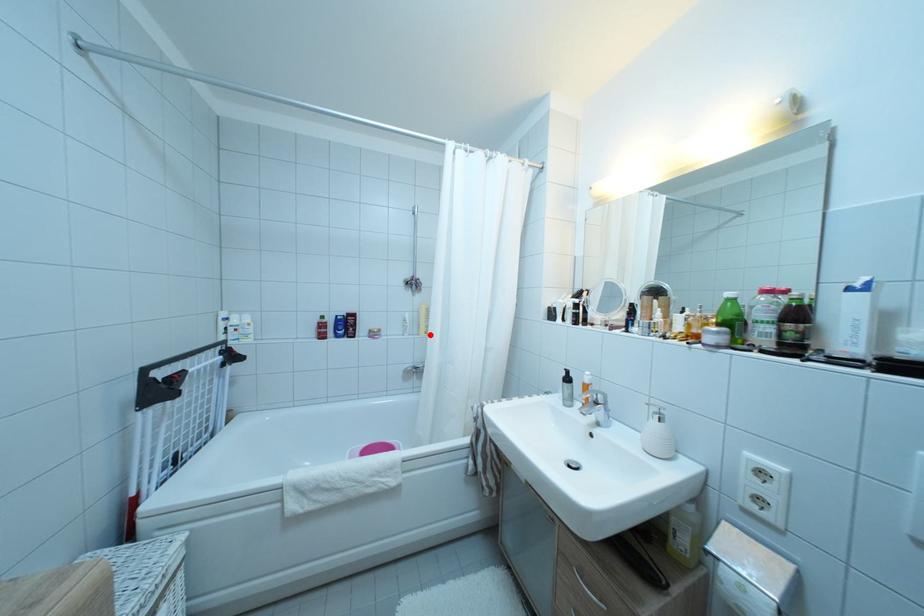
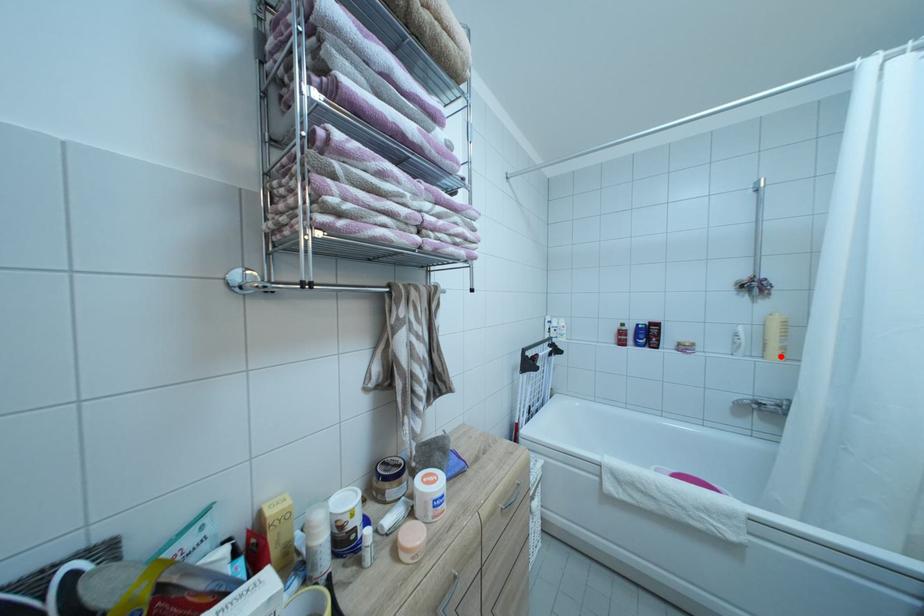
I am providing you with two images of the same scene from different viewpoints. A red point is marked on the first image and another point is marked on the second image. Does the point marked in image1 correspond to the same location as the one in image2?

Yes